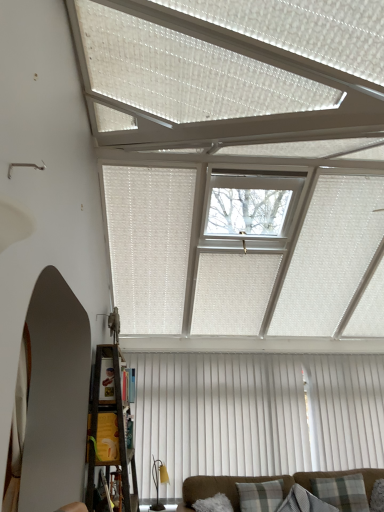
Question: From the image's perspective, does wooden bookshelf at lower left appear higher than white vertical blinds at center?

Choices:
 (A) no
 (B) yes

Answer: (B)

Question: Considering the relative sizes of wooden bookshelf at lower left and white vertical blinds at center in the image provided, is wooden bookshelf at lower left taller than white vertical blinds at center?

Choices:
 (A) yes
 (B) no

Answer: (B)

Question: Does wooden bookshelf at lower left have a lesser height compared to white vertical blinds at center?

Choices:
 (A) no
 (B) yes

Answer: (B)

Question: From a real-world perspective, is wooden bookshelf at lower left positioned over white vertical blinds at center based on gravity?

Choices:
 (A) no
 (B) yes

Answer: (A)

Question: Does wooden bookshelf at lower left have a greater width compared to white vertical blinds at center?

Choices:
 (A) no
 (B) yes

Answer: (B)

Question: Is wooden bookshelf at lower left beside white vertical blinds at center?

Choices:
 (A) yes
 (B) no

Answer: (B)

Question: Considering the relative sizes of plaid fabric pillow at lower right, the 1th pillow viewed from the right, and plaid fabric pillow at lower center, which appears as the 1th pillow when viewed from the left, in the image provided, is plaid fabric pillow at lower right, the 1th pillow viewed from the right, wider than plaid fabric pillow at lower center, which appears as the 1th pillow when viewed from the left,?

Choices:
 (A) yes
 (B) no

Answer: (A)

Question: From a real-world perspective, is plaid fabric pillow at lower right, the 1th pillow viewed from the right, located beneath plaid fabric pillow at lower center, the 3th pillow when ordered from right to left?

Choices:
 (A) yes
 (B) no

Answer: (B)

Question: Is plaid fabric pillow at lower center, the 3th pillow when ordered from right to left, at the back of plaid fabric pillow at lower right, which is the 3th pillow in left-to-right order?

Choices:
 (A) yes
 (B) no

Answer: (B)

Question: Is plaid fabric pillow at lower right, the 1th pillow viewed from the right, not close to plaid fabric pillow at lower center, the 3th pillow when ordered from right to left?

Choices:
 (A) no
 (B) yes

Answer: (A)

Question: From the image's perspective, would you say plaid fabric pillow at lower right, which is the 3th pillow in left-to-right order, is shown under plaid fabric pillow at lower center, which appears as the 1th pillow when viewed from the left?

Choices:
 (A) yes
 (B) no

Answer: (B)

Question: Can we say plaid fabric pillow at lower right, which is the 3th pillow in left-to-right order, lies outside plaid fabric pillow at lower center, the 3th pillow when ordered from right to left?

Choices:
 (A) no
 (B) yes

Answer: (B)

Question: Is clear glass window at center positioned before white vertical blinds at center?

Choices:
 (A) no
 (B) yes

Answer: (B)